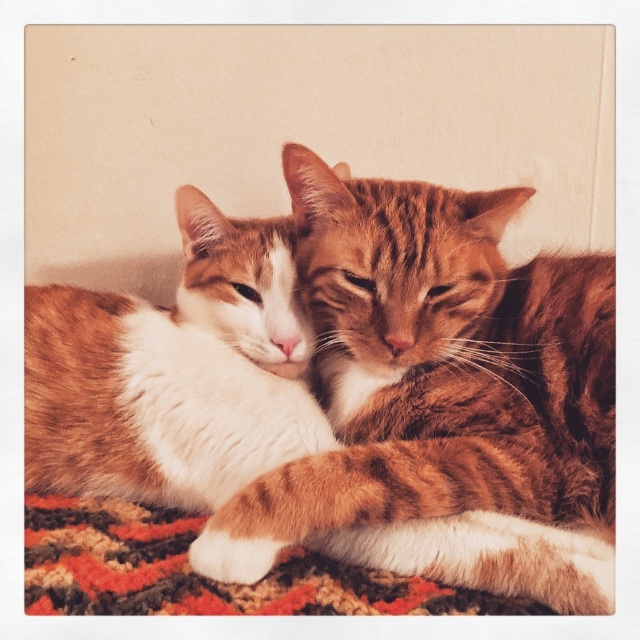
You are standing 1 meter away from a wall. You see a point marked at coordinates point (172,426). Can you reach the point without moving closer than 1 meter to the wall?

The distance of point (172,426) from viewer is 1.12 meters, so you are currently 1 meter away from the wall. Since 1.12 meters is farther than 1 meter, you can reach the point without moving closer than 1 meter to the wall.

You are a photographer trying to capture the two cats on the carpeted mat at lower center. You want to ensure the orange tabby cat at center is framed to the right side of the mat. Is the current position of the orange tabty cat at center suitable for your shot?

The orange tabby cat at center is positioned on the right side of the carpeted mat at lower center, so yes, its current position is suitable for framing it to the right side of the mat.